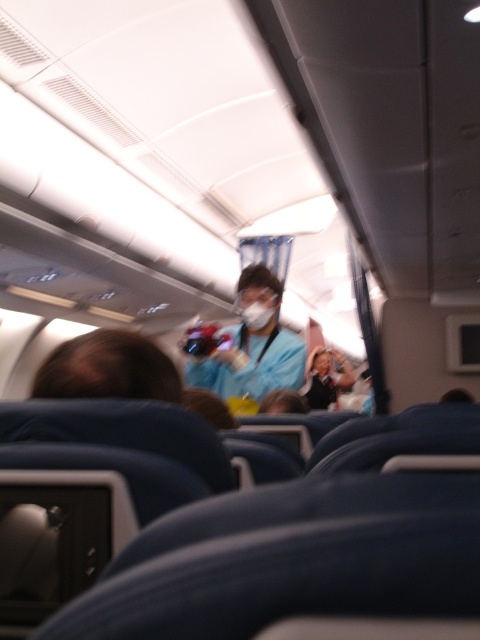
Image resolution: width=480 pixels, height=640 pixels. Describe the element at coordinates (252, 346) in the screenshot. I see `matte blue uniform at center` at that location.

The width and height of the screenshot is (480, 640). Identify the location of matte blue uniform at center. (252, 346).